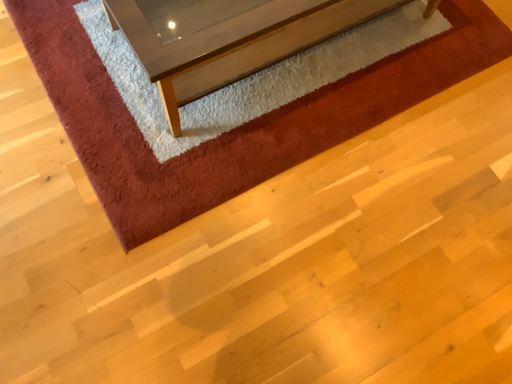
Question: Based on their positions, is shaggy red carpet at upper center located to the left or right of clear glass coffee table at upper center?

Choices:
 (A) right
 (B) left

Answer: (B)

Question: In terms of size, does shaggy red carpet at upper center appear bigger or smaller than clear glass coffee table at upper center?

Choices:
 (A) big
 (B) small

Answer: (B)

Question: Is shaggy red carpet at upper center wider or thinner than clear glass coffee table at upper center?

Choices:
 (A) wide
 (B) thin

Answer: (A)

Question: In terms of size, does clear glass coffee table at upper center appear bigger or smaller than shaggy red carpet at upper center?

Choices:
 (A) small
 (B) big

Answer: (B)

Question: From their relative heights in the image, would you say clear glass coffee table at upper center is taller or shorter than shaggy red carpet at upper center?

Choices:
 (A) tall
 (B) short

Answer: (A)

Question: From a real-world perspective, relative to shaggy red carpet at upper center, is clear glass coffee table at upper center vertically above or below?

Choices:
 (A) below
 (B) above

Answer: (B)

Question: From the image's perspective, is clear glass coffee table at upper center positioned above or below shaggy red carpet at upper center?

Choices:
 (A) below
 (B) above

Answer: (B)